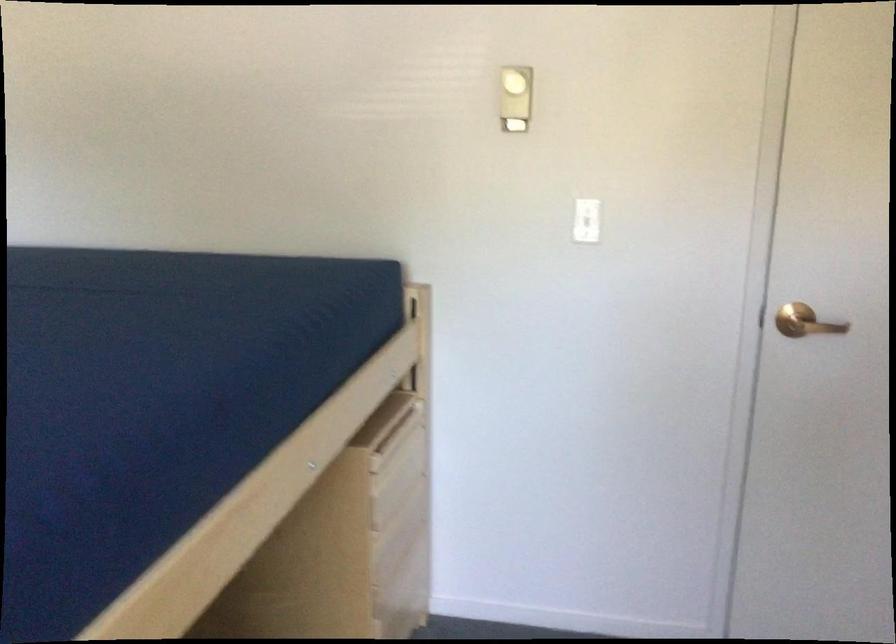
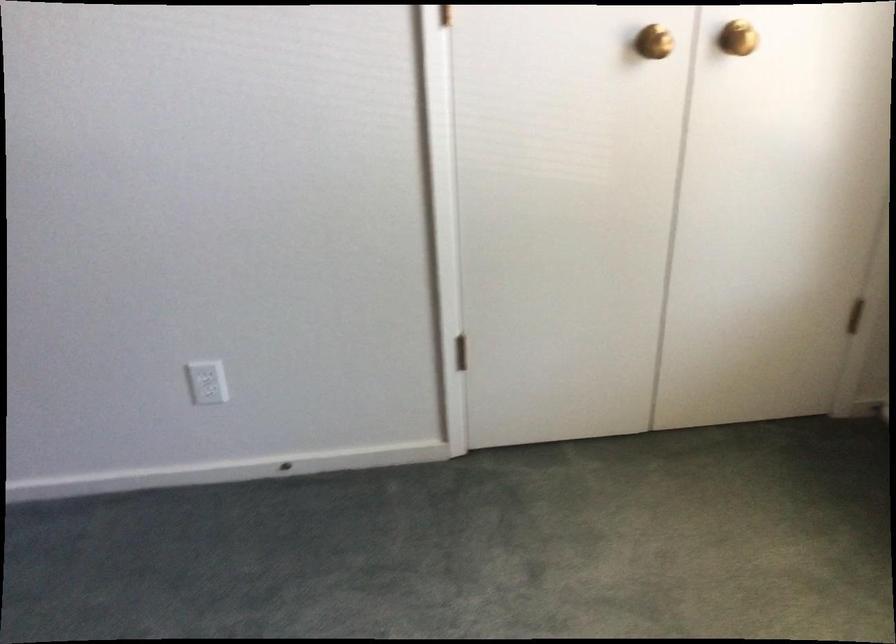
First-person continuous shooting, in which direction is the camera rotating?

The camera's rotation is toward right-down.